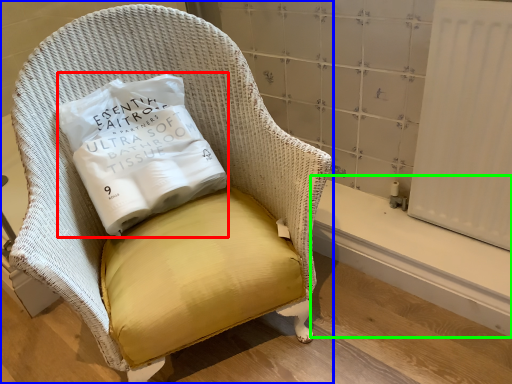
Question: Which is nearer to the pillow (highlighted by a red box)? chair (highlighted by a blue box) or window sill (highlighted by a green box).

Choices:
 (A) chair
 (B) window sill

Answer: (A)